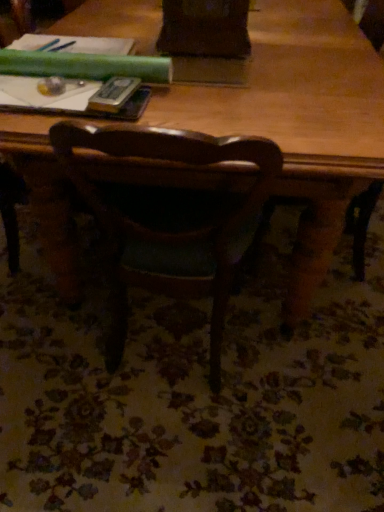
Question: Is the depth of wooden table at center greater than that of metallic silver paperback book at upper center?

Choices:
 (A) yes
 (B) no

Answer: (B)

Question: Considering the relative sizes of wooden table at center and metallic silver paperback book at upper center in the image provided, is wooden table at center shorter than metallic silver paperback book at upper center?

Choices:
 (A) no
 (B) yes

Answer: (A)

Question: Considering the relative sizes of wooden table at center and metallic silver paperback book at upper center in the image provided, is wooden table at center wider than metallic silver paperback book at upper center?

Choices:
 (A) no
 (B) yes

Answer: (B)

Question: Is wooden table at center taller than metallic silver paperback book at upper center?

Choices:
 (A) yes
 (B) no

Answer: (A)

Question: From the image's perspective, does wooden table at center appear higher than metallic silver paperback book at upper center?

Choices:
 (A) no
 (B) yes

Answer: (B)

Question: Is metallic silver paperback book at upper center a part of wooden table at center?

Choices:
 (A) no
 (B) yes

Answer: (A)

Question: Is hardcover book at upper left surrounded by wooden table at center?

Choices:
 (A) no
 (B) yes

Answer: (B)

Question: Does wooden table at center appear on the right side of hardcover book at upper left?

Choices:
 (A) no
 (B) yes

Answer: (B)

Question: From the image's perspective, is wooden table at center above hardcover book at upper left?

Choices:
 (A) yes
 (B) no

Answer: (A)

Question: Would you say wooden table at center is a long distance from hardcover book at upper left?

Choices:
 (A) no
 (B) yes

Answer: (A)

Question: Is wooden table at center looking in the opposite direction of hardcover book at upper left?

Choices:
 (A) no
 (B) yes

Answer: (A)

Question: Does wooden table at center have a smaller size compared to hardcover book at upper left?

Choices:
 (A) yes
 (B) no

Answer: (B)

Question: Is wooden table at center surrounded by hardcover book at upper left?

Choices:
 (A) yes
 (B) no

Answer: (B)